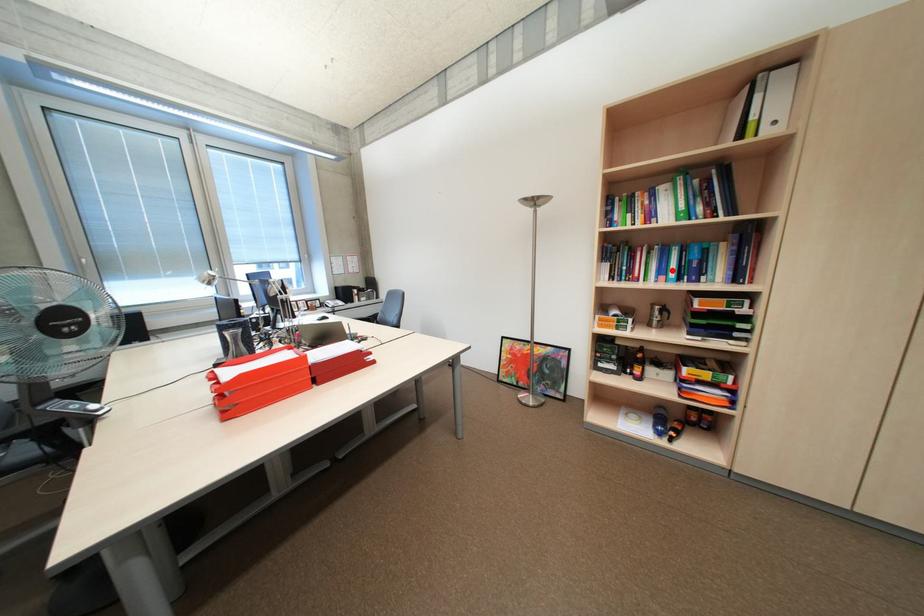
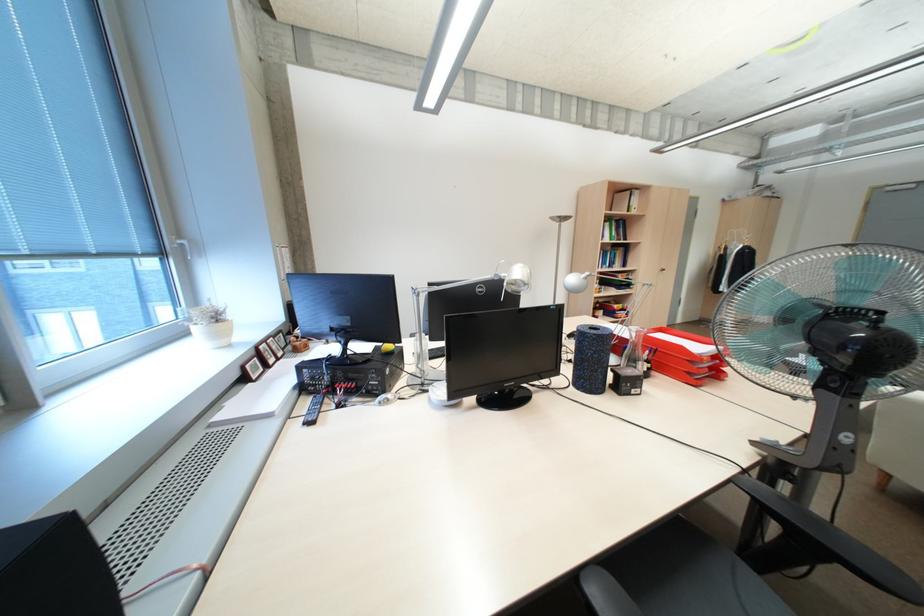
Question: I am providing you with two images of the same scene from different viewpoints. A red point is marked on the first image. At the location where the point appears in image 1, is it still visible in image 2?

Choices:
 (A) Yes
 (B) No

Answer: (A)